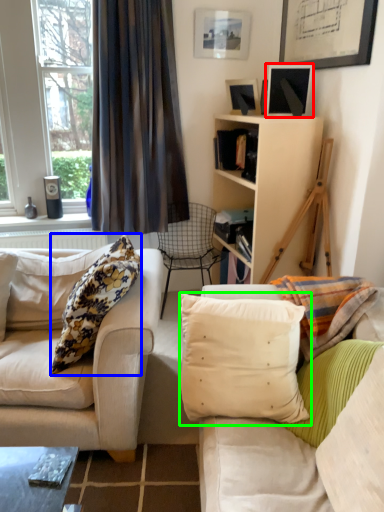
Question: Which object is positioned farthest from picture frame (highlighted by a red box)? Select from pillow (highlighted by a blue box) and pillow (highlighted by a green box).

Choices:
 (A) pillow
 (B) pillow

Answer: (B)